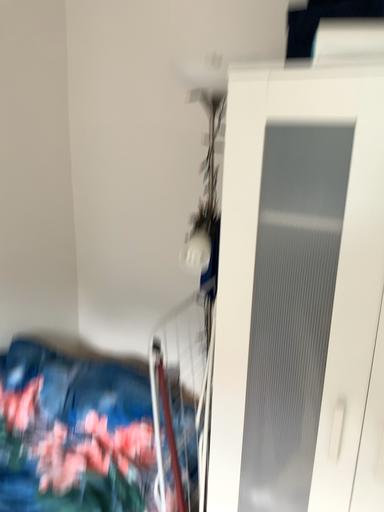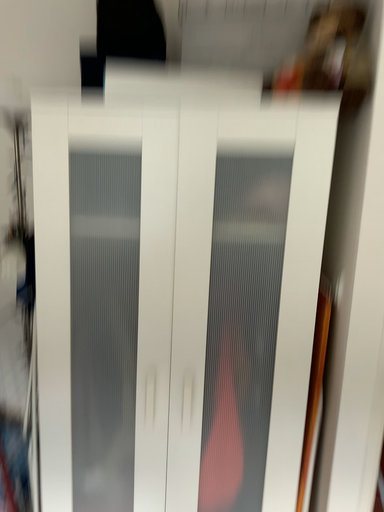
Question: Which way did the camera rotate in the video?

Choices:
 (A) rotated left
 (B) rotated right

Answer: (B)